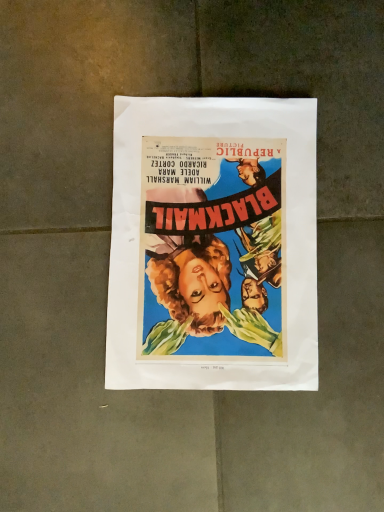
Where is `free point above vibrant paper poster at center (from a real-world perspective)`? The image size is (384, 512). free point above vibrant paper poster at center (from a real-world perspective) is located at coordinates (213, 237).